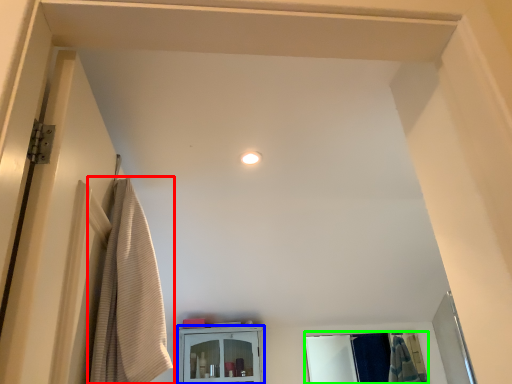
Question: Which object is positioned farthest from curtain (highlighted by a red box)? Select from cabinetry (highlighted by a blue box) and mirror (highlighted by a green box).

Choices:
 (A) cabinetry
 (B) mirror

Answer: (B)